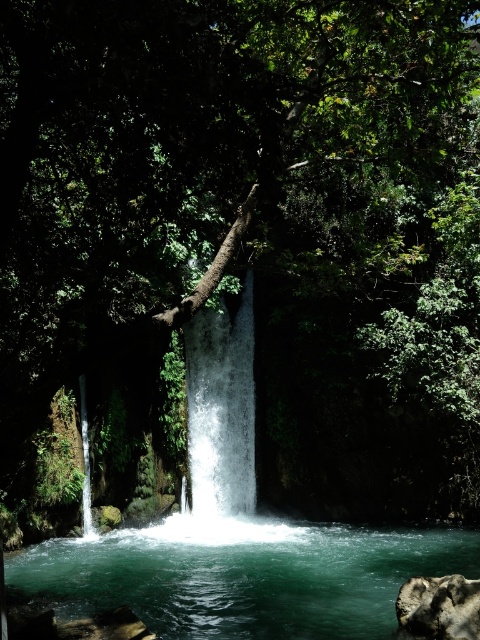
Who is positioned more to the left, clear water at center or white frothy water at center?

white frothy water at center is more to the left.

Does clear water at center appear under white frothy water at center?

Yes, clear water at center is below white frothy water at center.

In order to click on clear water at center in this screenshot , I will do `click(242, 576)`.

Is clear water at center behind gray rough rock at lower right?

Yes, clear water at center is further from the viewer.

Is point (395, 545) farther from viewer compared to point (436, 611)?

Yes, point (395, 545) is farther from viewer.

Does point (183, 580) come farther from viewer compared to point (410, 625)?

Yes, point (183, 580) is behind point (410, 625).

The height and width of the screenshot is (640, 480). Identify the location of clear water at center. (242, 576).

Can you confirm if white frothy water at center is bigger than gray rough rock at lower right?

No, white frothy water at center is not bigger than gray rough rock at lower right.

Between point (204, 320) and point (428, 634), which one is positioned behind?

Positioned behind is point (204, 320).

The height and width of the screenshot is (640, 480). Identify the location of white frothy water at center. (222, 406).